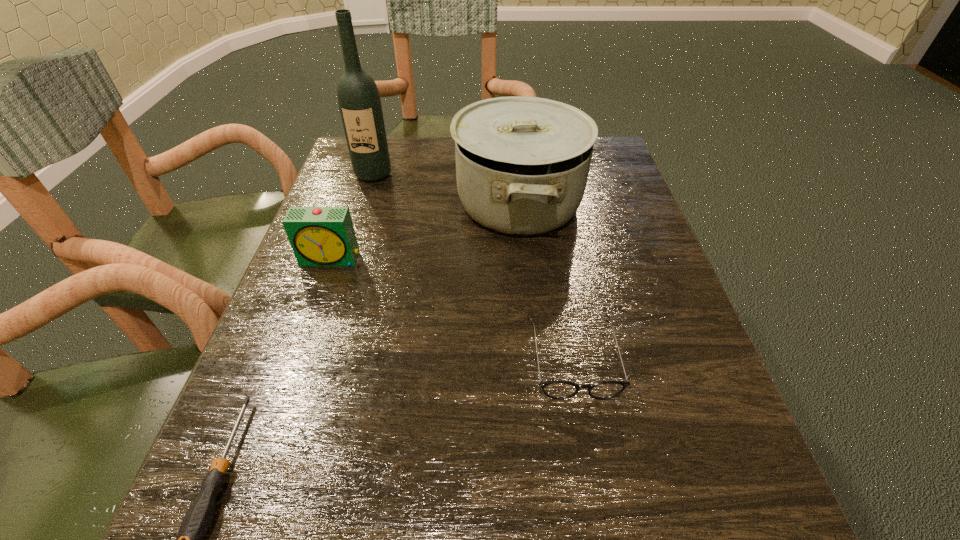
This screenshot has height=540, width=960. What are the coordinates of `saucepan present at the far edge` in the screenshot? It's located at (522, 163).

At what (x,y) coordinates should I click in order to perform the action: click on wine bottle that is at the left edge. Please return your answer as a coordinate pair (x, y). Looking at the image, I should click on click(359, 101).

The width and height of the screenshot is (960, 540). Identify the location of alarm clock present at the left edge. (320, 236).

Identify the location of saucepan at the right edge. This screenshot has width=960, height=540. (522, 163).

Where is `spectacles present at the right edge`? This screenshot has height=540, width=960. spectacles present at the right edge is located at coordinates tap(559, 390).

Where is `object at the far left corner`? The height and width of the screenshot is (540, 960). object at the far left corner is located at coordinates (359, 101).

The height and width of the screenshot is (540, 960). I want to click on object situated at the far right corner, so click(522, 163).

Image resolution: width=960 pixels, height=540 pixels. In the image, there is a desktop. Identify the location of free space at the far edge. (411, 184).

Find the location of `blank space at the left edge`. blank space at the left edge is located at coordinates coord(368,204).

I want to click on free space at the right edge of the desktop, so click(644, 327).